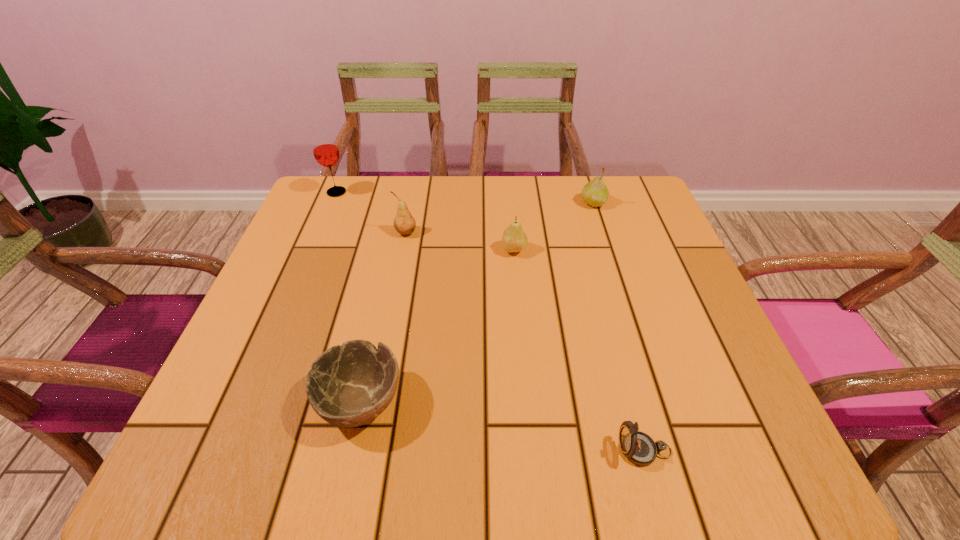
In the image, there is a desktop. Where is `vacant space at the far left corner`? vacant space at the far left corner is located at coordinates (361, 207).

In the image, there is a desktop. Where is `vacant area at the near left corner`? This screenshot has height=540, width=960. vacant area at the near left corner is located at coordinates (200, 464).

The image size is (960, 540). I want to click on empty space between the bowl and the third farthest object, so click(x=383, y=317).

This screenshot has width=960, height=540. In order to click on empty space between the glass and the compass in this screenshot , I will do `click(491, 321)`.

Where is `free spot between the leftmost pear and the third nearest object`? free spot between the leftmost pear and the third nearest object is located at coordinates (460, 241).

Find the location of `unoccupied position between the leftmost object and the fourth object from left to right`. unoccupied position between the leftmost object and the fourth object from left to right is located at coordinates (425, 221).

Where is `empty space between the third shortest object and the compass`? This screenshot has width=960, height=540. empty space between the third shortest object and the compass is located at coordinates (579, 350).

Find the location of a particular element. The width and height of the screenshot is (960, 540). vacant area between the bowl and the farthest pear is located at coordinates (477, 302).

Locate an element on the screen. This screenshot has width=960, height=540. unoccupied position between the rightmost pear and the compass is located at coordinates (619, 327).

This screenshot has width=960, height=540. In order to click on free space that is in between the bowl and the leftmost object in this screenshot , I will do `click(348, 297)`.